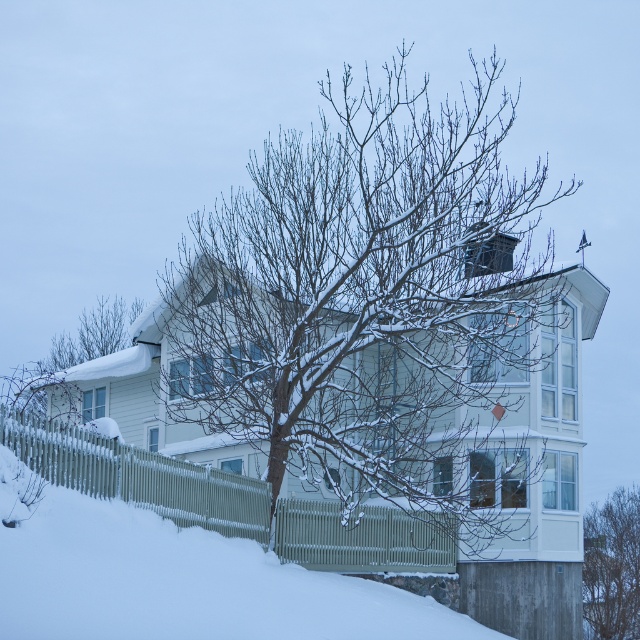
Measure the distance from snow-covered bare tree at center to bare branches at lower right.

14.55 meters

Who is more forward, (362, 218) or (593, 577)?

Positioned in front is point (362, 218).

Who is more distant from viewer, [356,378] or [624,577]?

The point [624,577] is more distant.

This screenshot has height=640, width=640. Identify the location of snow-covered bare tree at center. (374, 307).

Is green painted wood fence at lower left closer to the viewer compared to snow-covered branches at left?

Yes.

Is point (177, 506) positioned before point (104, 301)?

That is True.

Identify the location of green painted wood fence at lower left. Image resolution: width=640 pixels, height=640 pixels. (140, 476).

Identify the location of green painted wood fence at lower left. This screenshot has height=640, width=640. (140, 476).

Is green painted wood fence at lower left to the right of bare branches at lower right from the viewer's perspective?

Incorrect, green painted wood fence at lower left is not on the right side of bare branches at lower right.

Find the location of a particular element. Image resolution: width=640 pixels, height=640 pixels. green painted wood fence at lower left is located at coordinates (140, 476).